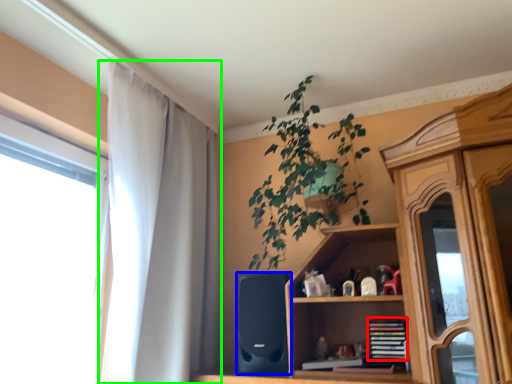
Question: Based on their relative distances, which object is nearer to book (highlighted by a red box)? Choose from speaker (highlighted by a blue box) and curtain (highlighted by a green box).

Choices:
 (A) speaker
 (B) curtain

Answer: (A)